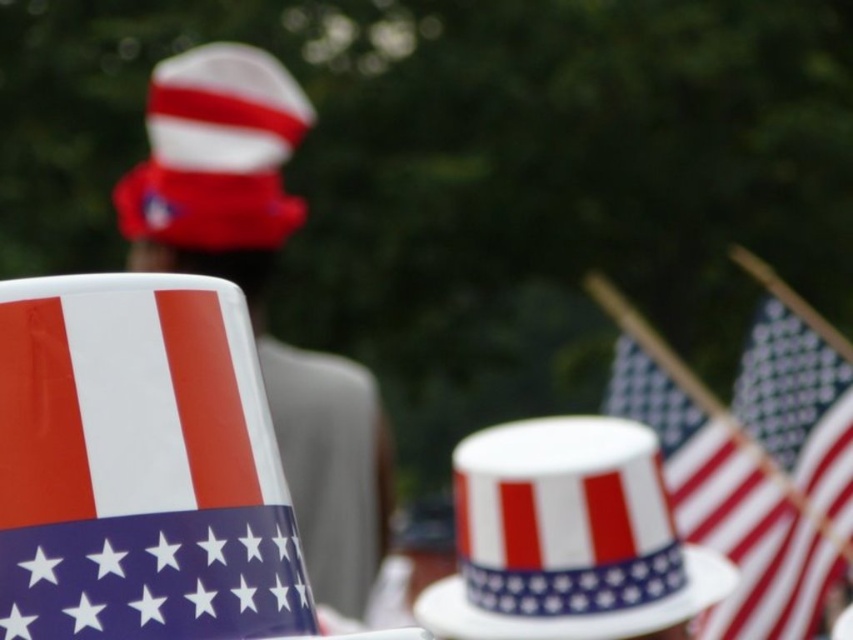
You are holding a camera and want to take a closeup photo of the porcelain cup with american flag design at left. The camera requires that the subject must be within 30 inches to focus properly. Can you take the photo as it is?

The porcelain cup with american flag design at left is 32.85 inches away from the camera, which is beyond the 30 inches requirement. Therefore, you cannot take the photo as it is and need to move closer or adjust the camera position.

You are at a patriotic event and see the porcelain cup with american flag design at left and the polka dot fabric flag at center. Which object is nearer to you?

The porcelain cup with american flag design at left is closer to the viewer than the polka dot fabric flag at center.